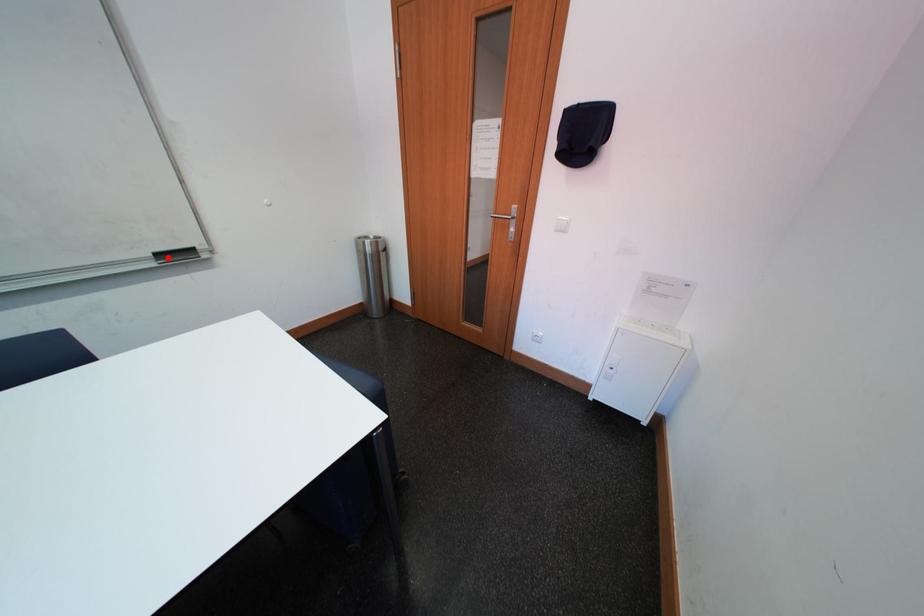
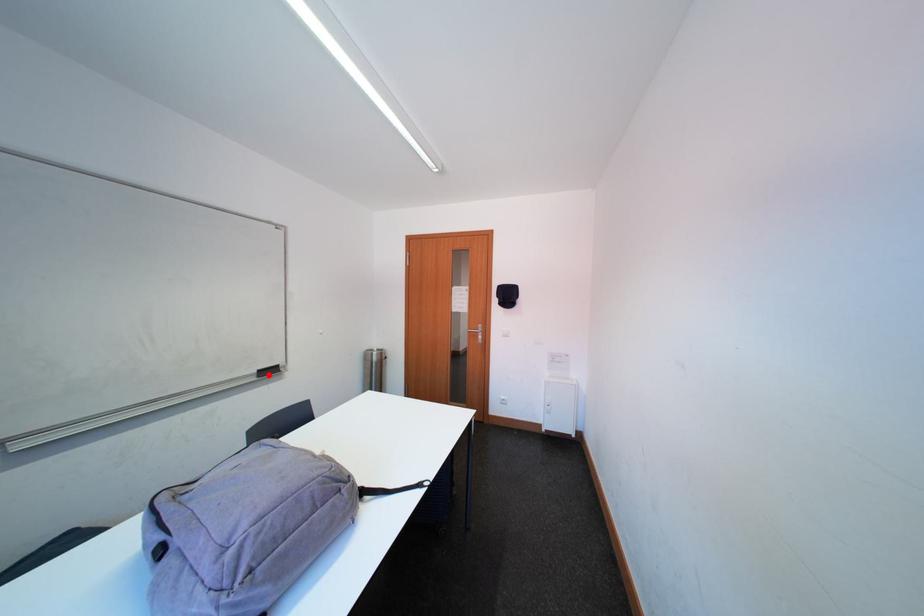
I am providing you with two images of the same scene from different viewpoints. A red point is marked on the first image and another point is marked on the second image. Is the red point in image1 aligned with the point shown in image2?

Yes